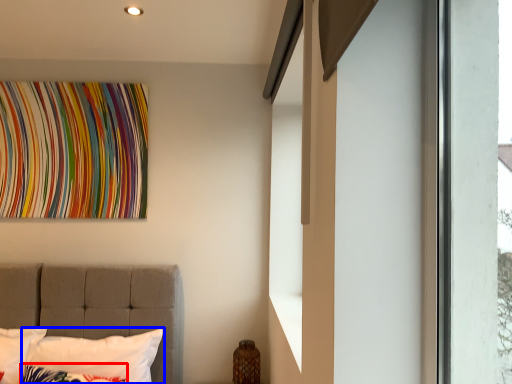
Question: Which object is further to the camera taking this photo, pillow (highlighted by a red box) or pillow (highlighted by a blue box)?

Choices:
 (A) pillow
 (B) pillow

Answer: (B)